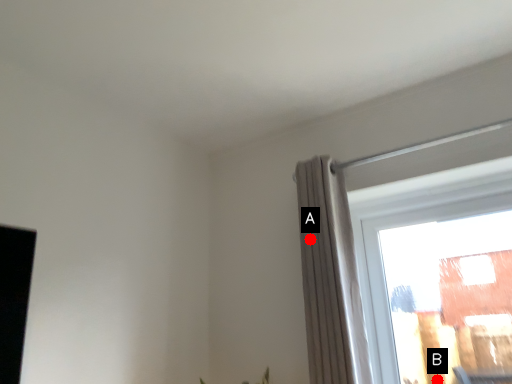
Question: Two points are circled on the image, labeled by A and B beside each circle. Among these points, which one is farthest from the camera?

Choices:
 (A) A is further
 (B) B is further

Answer: (B)